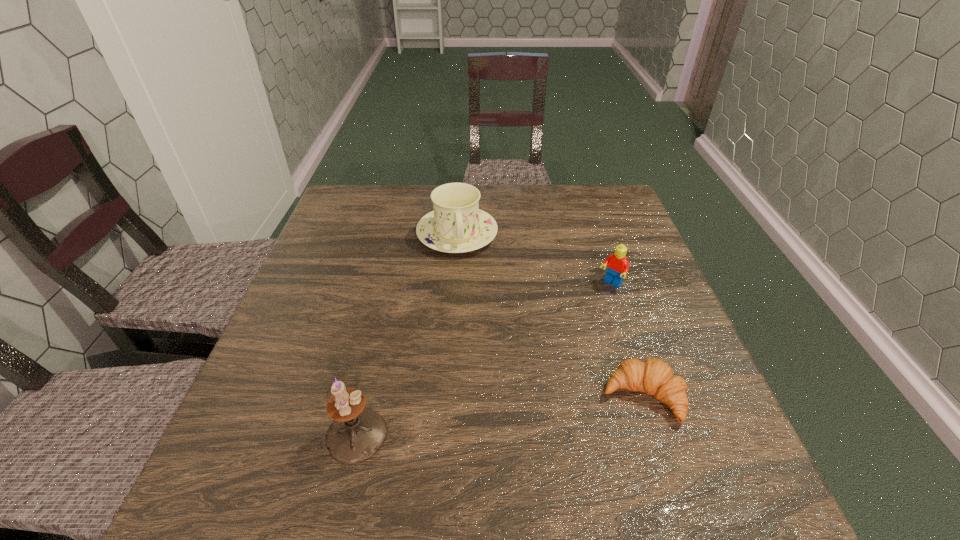
Identify the location of free space on the desktop that is between the candle holder and the crescent roll and is positioned on the handle side of the chinaware. (491, 417).

Locate an element on the screen. vacant spot on the desktop that is between the tallest object and the shortest object and is positioned on the face of the third nearest object is located at coordinates (492, 417).